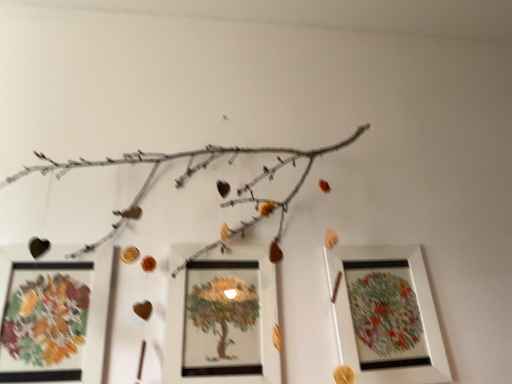
Question: Can you confirm if white matte picture frame at right, marked as the third picture frame in a left-to-right arrangement, is positioned to the left of matte white picture frame at center, positioned as the 2th picture frame in left-to-right order?

Choices:
 (A) yes
 (B) no

Answer: (B)

Question: Does white matte picture frame at right, marked as the third picture frame in a left-to-right arrangement, have a lesser width compared to matte white picture frame at center, positioned as the 2th picture frame in left-to-right order?

Choices:
 (A) no
 (B) yes

Answer: (A)

Question: From the image's perspective, is white matte picture frame at right, marked as the third picture frame in a left-to-right arrangement, beneath matte white picture frame at center, positioned as the 2th picture frame in left-to-right order?

Choices:
 (A) no
 (B) yes

Answer: (B)

Question: From a real-world perspective, does white matte picture frame at right, the first picture frame when ordered from right to left, sit lower than matte white picture frame at center, positioned as the 2th picture frame in left-to-right order?

Choices:
 (A) yes
 (B) no

Answer: (B)

Question: Is white matte picture frame at right, marked as the third picture frame in a left-to-right arrangement, in front of matte white picture frame at center, positioned as the 2th picture frame in left-to-right order?

Choices:
 (A) no
 (B) yes

Answer: (A)

Question: Could matte white picture frame at center, positioned as the 2th picture frame in right-to-left order, be considered to be inside white matte picture frame at right, the first picture frame when ordered from right to left?

Choices:
 (A) no
 (B) yes

Answer: (A)

Question: Can you confirm if matte glass picture frame at lower left, which ranks as the first picture frame in left-to-right order, is thinner than matte white picture frame at center, positioned as the 2th picture frame in left-to-right order?

Choices:
 (A) no
 (B) yes

Answer: (B)

Question: Is the position of matte glass picture frame at lower left, the third picture frame from the right, less distant than that of matte white picture frame at center, positioned as the 2th picture frame in right-to-left order?

Choices:
 (A) no
 (B) yes

Answer: (B)

Question: Can you confirm if matte glass picture frame at lower left, the third picture frame from the right, is smaller than matte white picture frame at center, positioned as the 2th picture frame in right-to-left order?

Choices:
 (A) no
 (B) yes

Answer: (A)

Question: Does matte glass picture frame at lower left, the third picture frame from the right, appear on the right side of matte white picture frame at center, positioned as the 2th picture frame in right-to-left order?

Choices:
 (A) no
 (B) yes

Answer: (A)

Question: From the image's perspective, does matte glass picture frame at lower left, the third picture frame from the right, appear higher than matte white picture frame at center, positioned as the 2th picture frame in right-to-left order?

Choices:
 (A) no
 (B) yes

Answer: (B)

Question: Does matte glass picture frame at lower left, the third picture frame from the right, have a lesser height compared to matte white picture frame at center, positioned as the 2th picture frame in left-to-right order?

Choices:
 (A) no
 (B) yes

Answer: (B)

Question: Is matte white picture frame at center, positioned as the 2th picture frame in right-to-left order, at the left side of matte glass picture frame at lower left, the third picture frame from the right?

Choices:
 (A) yes
 (B) no

Answer: (B)